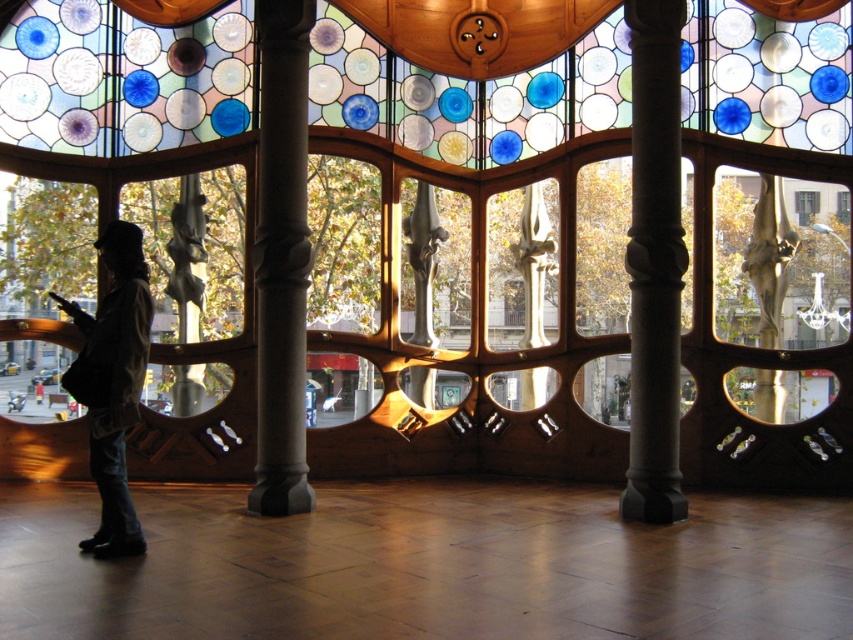
You are an architect evaluating the structural integrity of the carved stone column at center and the slate gray stone column at center. Which column would you recommend reinforcing first based on its size?

The carved stone column at center is larger in size than the slate gray stone column at center, so it may require more support and should be reinforced first.

You are standing in the interior space with the arched stained glass panels above. There is a point marked at coordinates (654,262). What object does this point correspond to?

The point corresponds to the carved stone column at center.